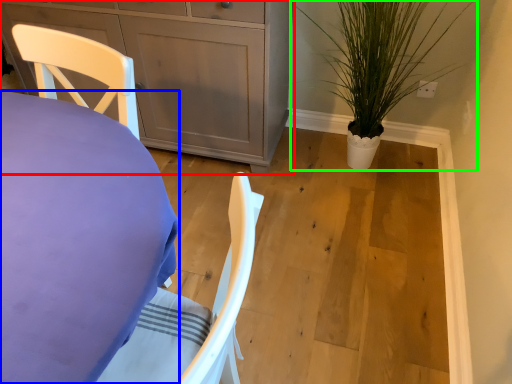
Question: Which object is positioned farthest from cabinetry (highlighted by a red box)? Select from desk (highlighted by a blue box) and houseplant (highlighted by a green box).

Choices:
 (A) desk
 (B) houseplant

Answer: (A)